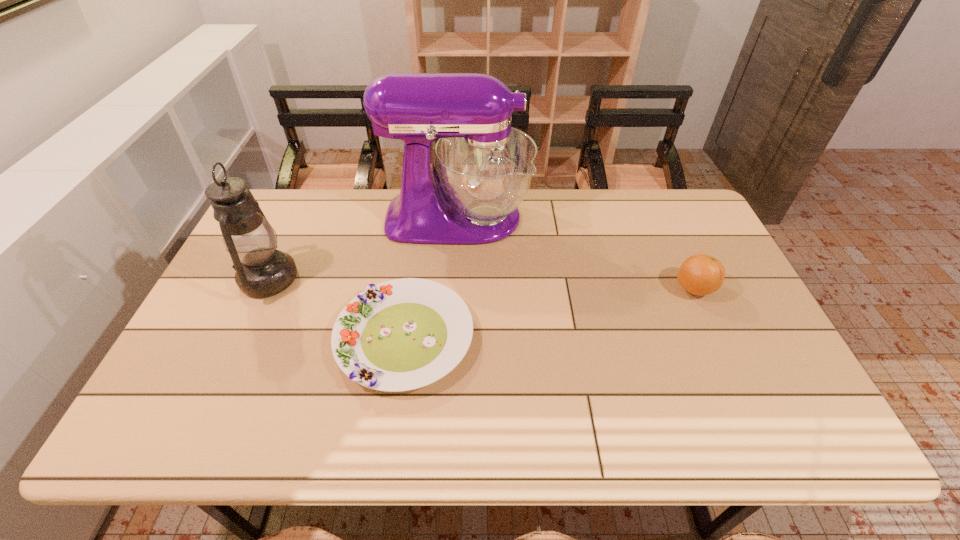
At what (x,y) coordinates should I click in order to perform the action: click on object that can be found as the closest to the leftmost object. Please return your answer as a coordinate pair (x, y). The image size is (960, 540). Looking at the image, I should click on (403, 334).

At what (x,y) coordinates should I click in order to perform the action: click on vacant space that satisfies the following two spatial constraints: 1. at the bowl opening of the farthest object; 2. on the right side of the second shortest object. Please return your answer as a coordinate pair (x, y). This screenshot has height=540, width=960. Looking at the image, I should click on (454, 289).

Locate an element on the screen. vacant point that satisfies the following two spatial constraints: 1. at the bowl opening of the tallest object; 2. on the front side of the salad plate is located at coordinates (451, 338).

You are a GUI agent. You are given a task and a screenshot of the screen. Output one action in this format:
    pyautogui.click(x=<x>, y=<y>)
    Task: Click on the vacant area in the image that satisfies the following two spatial constraints: 1. at the bowl opening of the orange; 2. on the left side of the farthest object
    The width and height of the screenshot is (960, 540).
    Given the screenshot: What is the action you would take?
    pyautogui.click(x=454, y=289)

Where is `free location that satisfies the following two spatial constraints: 1. at the bowl opening of the orange; 2. on the right side of the mixer`? free location that satisfies the following two spatial constraints: 1. at the bowl opening of the orange; 2. on the right side of the mixer is located at coordinates (454, 289).